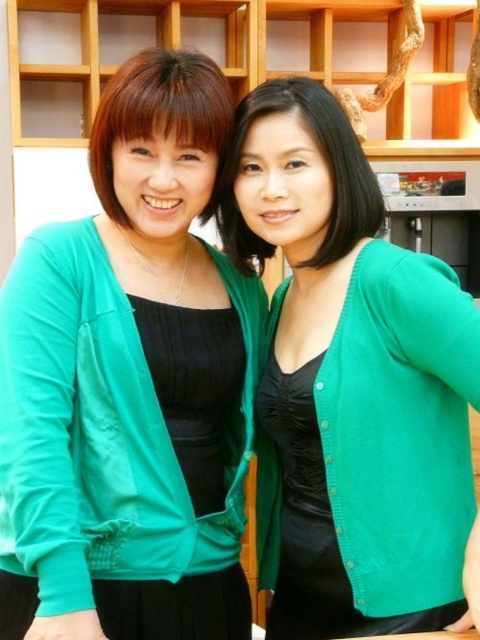
You are a fashion designer preparing to take a photo of two models wearing the green matte cardigan at center and the matte black blouse at left. You need to ensure that the cardigan appears wider in the photo than the blouse. Based on the scene description, will this arrangement naturally occur without any adjustments?

Yes, the green matte cardigan at center is wider than the matte black blouse at left according to the description, so the arrangement will naturally show the cardigan as wider without needing adjustments.